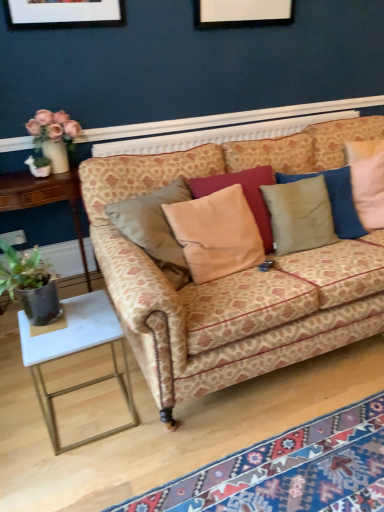
Question: Is patterned fabric couch at center looking in the opposite direction of carpet with geometric patterns at lower right?

Choices:
 (A) yes
 (B) no

Answer: (B)

Question: From the image's perspective, does patterned fabric couch at center appear lower than carpet with geometric patterns at lower right?

Choices:
 (A) no
 (B) yes

Answer: (A)

Question: Does patterned fabric couch at center lie in front of carpet with geometric patterns at lower right?

Choices:
 (A) no
 (B) yes

Answer: (A)

Question: Does patterned fabric couch at center appear on the left side of carpet with geometric patterns at lower right?

Choices:
 (A) yes
 (B) no

Answer: (B)

Question: From a real-world perspective, is patterned fabric couch at center under carpet with geometric patterns at lower right?

Choices:
 (A) no
 (B) yes

Answer: (A)

Question: Looking at their shapes, would you say velvet beige pillow at center, which ranks as the second pillow in left-to-right order, is wider or thinner than white marble side table at lower left, marked as the second table in a back-to-front arrangement?

Choices:
 (A) wide
 (B) thin

Answer: (B)

Question: Is velvet beige pillow at center, which ranks as the second pillow in left-to-right order, inside or outside of white marble side table at lower left, the 2th table from the top?

Choices:
 (A) outside
 (B) inside

Answer: (A)

Question: Does point (317, 193) appear closer or farther from the camera than point (49, 424)?

Choices:
 (A) farther
 (B) closer

Answer: (A)

Question: In the image, is velvet beige pillow at center, which ranks as the second pillow in left-to-right order, on the left side or the right side of white marble side table at lower left, which is the first table in front-to-back order?

Choices:
 (A) right
 (B) left

Answer: (A)

Question: Considering the positions of matte ceramic vase at upper left and patterned fabric couch at center in the image, is matte ceramic vase at upper left taller or shorter than patterned fabric couch at center?

Choices:
 (A) tall
 (B) short

Answer: (B)

Question: Does point (61, 145) appear closer or farther from the camera than point (352, 329)?

Choices:
 (A) closer
 (B) farther

Answer: (B)

Question: Would you say matte ceramic vase at upper left is to the left or to the right of patterned fabric couch at center in the picture?

Choices:
 (A) left
 (B) right

Answer: (A)

Question: In terms of size, does matte ceramic vase at upper left appear bigger or smaller than patterned fabric couch at center?

Choices:
 (A) small
 (B) big

Answer: (A)

Question: Is patterned fabric couch at center bigger or smaller than dark green leafy plant at left?

Choices:
 (A) big
 (B) small

Answer: (A)

Question: Visually, is patterned fabric couch at center positioned to the left or to the right of dark green leafy plant at left?

Choices:
 (A) right
 (B) left

Answer: (A)